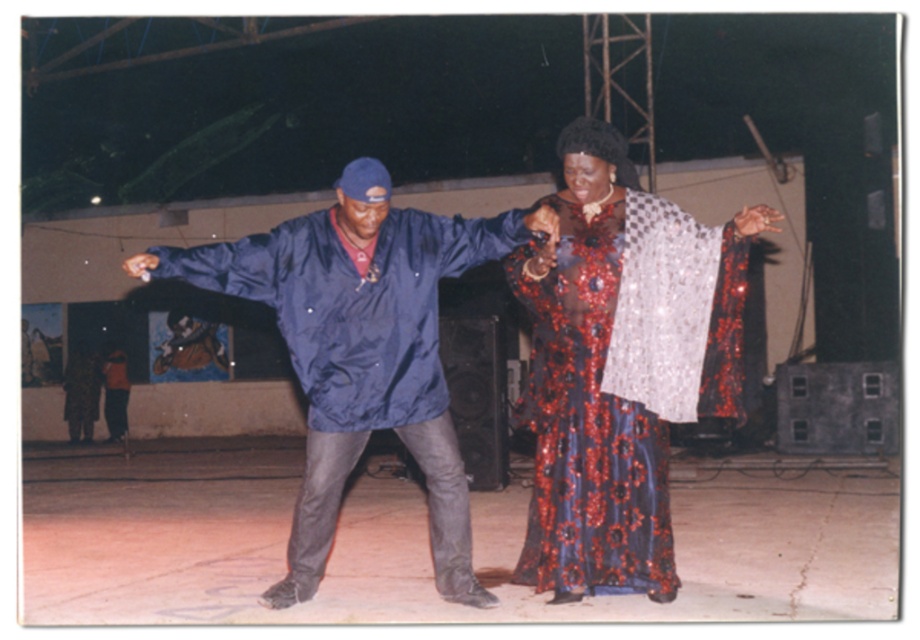
Question: Considering the real-world distances, which object is farthest from the shiny sequined dress at center?

Choices:
 (A) shiny blue jacket at center
 (B) orange fabric dress at lower left

Answer: (B)

Question: Can you confirm if shiny blue jacket at center is positioned to the right of orange fabric dress at lower left?

Choices:
 (A) yes
 (B) no

Answer: (A)

Question: Estimate the real-world distances between objects in this image. Which object is farther from the shiny blue jacket at center?

Choices:
 (A) shiny sequined dress at center
 (B) orange fabric dress at lower left

Answer: (B)

Question: Which object appears farthest from the camera in this image?

Choices:
 (A) shiny sequined dress at center
 (B) shiny blue jacket at center

Answer: (B)

Question: Does shiny blue jacket at center have a larger size compared to shiny sequined dress at center?

Choices:
 (A) yes
 (B) no

Answer: (A)

Question: Observing the image, what is the correct spatial positioning of shiny blue jacket at center in reference to shiny sequined dress at center?

Choices:
 (A) below
 (B) above

Answer: (A)